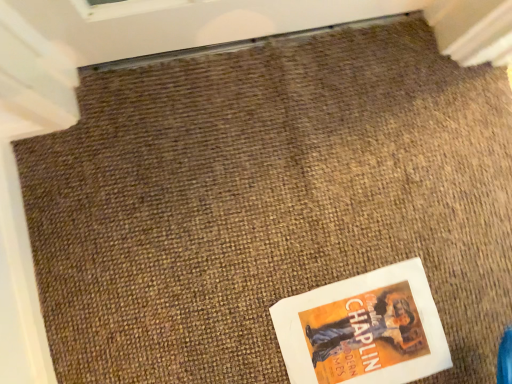
The width and height of the screenshot is (512, 384). I want to click on free point above orange paper poster at lower right (from a real-world perspective), so click(370, 335).